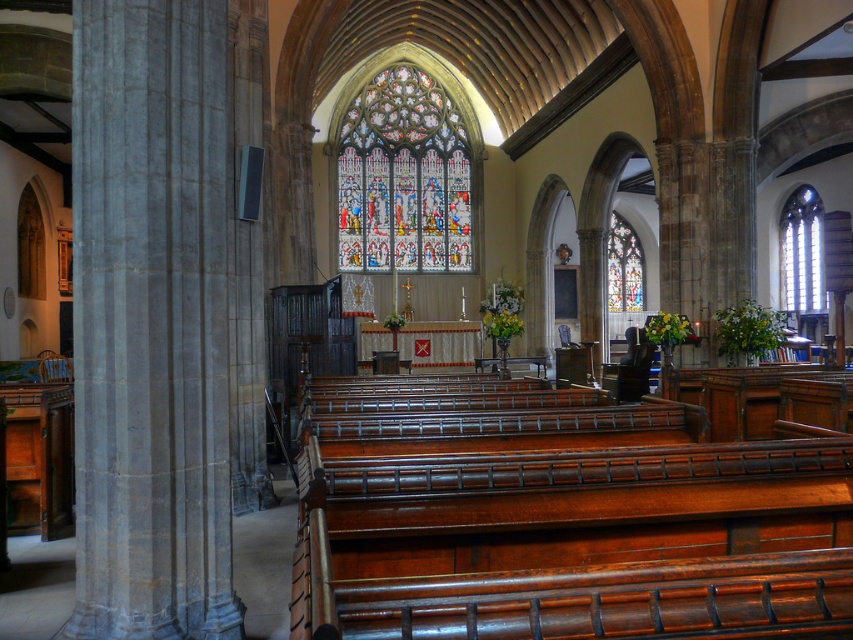
You are an architect analyzing the church interior. You observe the stained glass at center and the stained glass window at center. Which of these occupies a larger area in the image?

The stained glass window at center occupies a larger area than the stained glass at center.

You are standing in the nave of the church and want to locate both the stained glass at center and the stained glass window at center. According to the scene, which one is positioned to the left?

The stained glass at center is positioned to the left of the stained glass window at center.

You are an architect analyzing the church interior. You notice two stained glass elements, the stained glass at center and the stained glass window at center. Which one is located above the other?

The stained glass at center is positioned over the stained glass window at center.